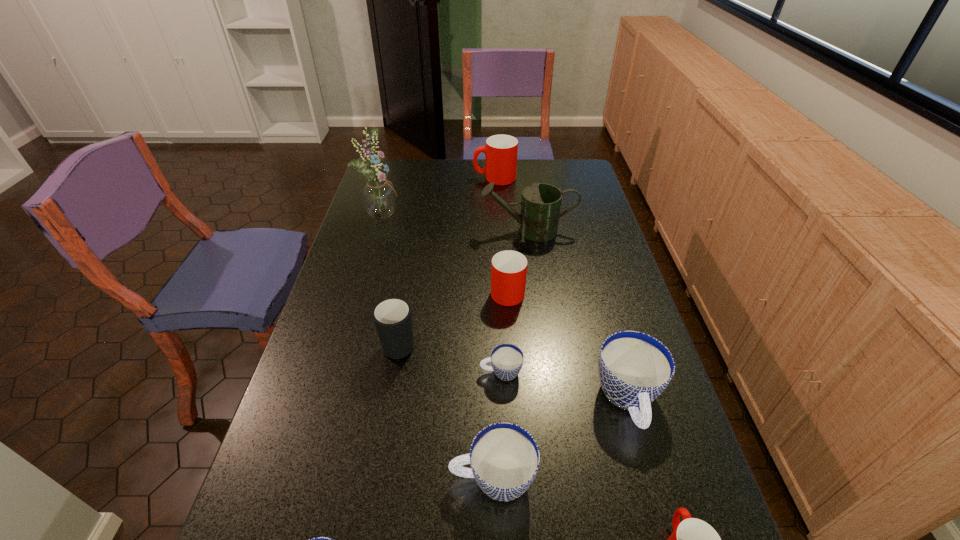
Find the location of a particular element. The height and width of the screenshot is (540, 960). the third nearest cup is located at coordinates coord(504,457).

This screenshot has height=540, width=960. Find the location of `the shortest cup`. the shortest cup is located at coordinates (506, 359).

At what (x,y) coordinates should I click in order to perform the action: click on the smallest blue cup. Please return your answer as a coordinate pair (x, y). This screenshot has height=540, width=960. Looking at the image, I should click on (x=506, y=359).

Where is `vacant space located on the front-facing side of the tallest object`? This screenshot has width=960, height=540. vacant space located on the front-facing side of the tallest object is located at coordinates (420, 213).

This screenshot has height=540, width=960. In order to click on free space located 0.230m with the spout on the green watering can in this screenshot , I will do `click(417, 231)`.

Find the location of `free space located with the spout on the green watering can`. free space located with the spout on the green watering can is located at coordinates (386, 231).

Find the location of a particular element. vacant space located 0.370m with the spout on the green watering can is located at coordinates (377, 231).

Locate an element on the screen. The height and width of the screenshot is (540, 960). blank space located 0.400m on the side of the farthest object with the handle is located at coordinates (378, 178).

I want to click on vacant space located on the side of the farthest object with the handle, so click(x=440, y=178).

Locate an element on the screen. Image resolution: width=960 pixels, height=540 pixels. free location located 0.380m on the side of the farthest object with the handle is located at coordinates (383, 178).